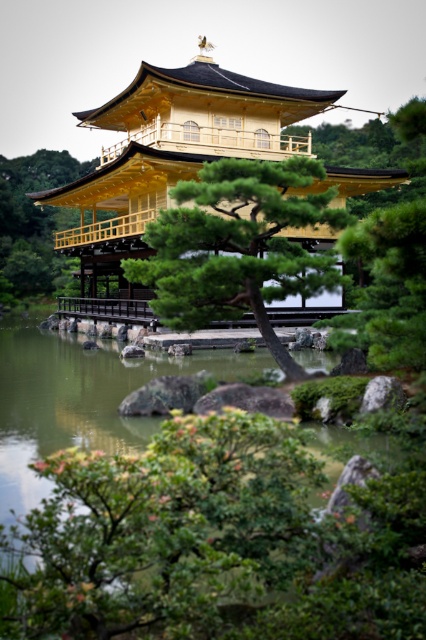
Between gold polished wood palace at center and green textured pine tree at center, which one is positioned lower?

Positioned lower is green textured pine tree at center.

Is gold polished wood palace at center closer to camera compared to green textured pine tree at center?

No, gold polished wood palace at center is further to the viewer.

Which is behind, point (226, 128) or point (181, 214)?

The point (226, 128) is more distant.

The image size is (426, 640). I want to click on gold polished wood palace at center, so click(169, 157).

Who is shorter, gold polished wood palace at center or green textured tree at center?

With less height is gold polished wood palace at center.

Measure the distance between gold polished wood palace at center and green textured tree at center.

The distance of gold polished wood palace at center from green textured tree at center is 77.00 feet.

Measure the distance between point (241, 132) and camera.

Point (241, 132) is 42.76 meters from camera.

This screenshot has width=426, height=640. Find the location of `gold polished wood palace at center`. gold polished wood palace at center is located at coordinates click(169, 157).

Who is higher up, green textured pine tree at center or green textured tree at center?

green textured tree at center

Which is in front, point (245, 163) or point (37, 227)?

Point (245, 163) is more forward.

Find the location of a particular element. green textured pine tree at center is located at coordinates (238, 246).